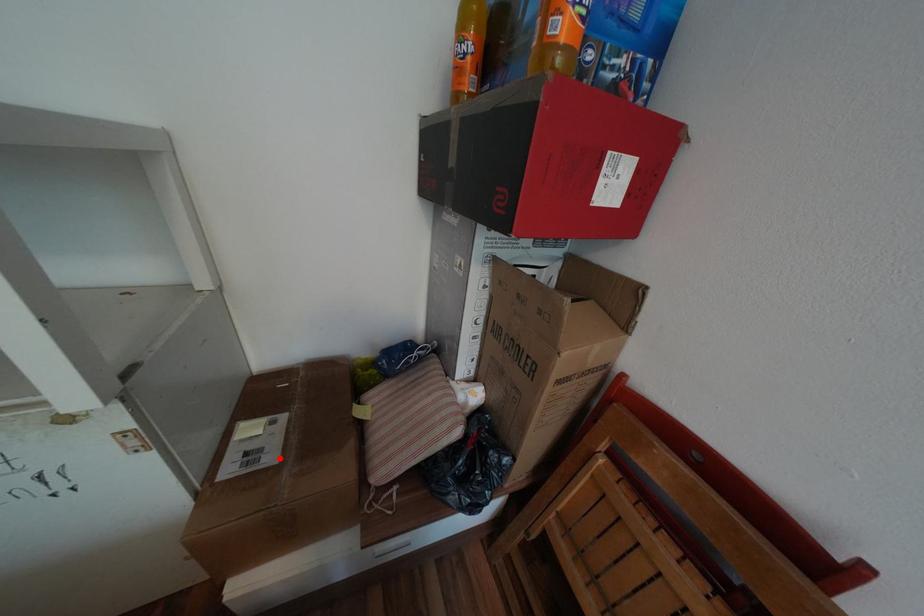
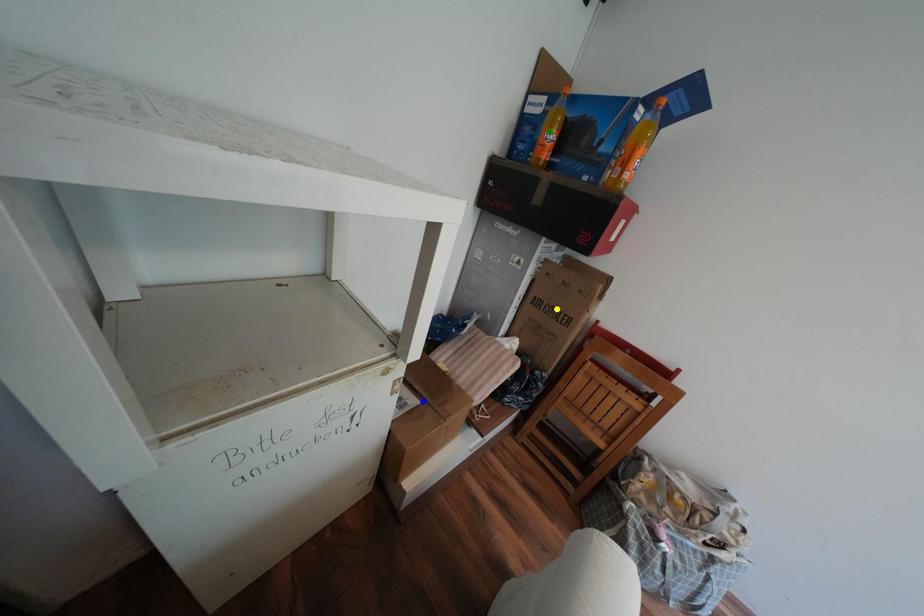
Question: I am providing you with two images of the same scene from different viewpoints. A red point is marked on the first image. You are given multiple points on the second image. Which point in image 2 is actually the same real-world point as the red point in image 1?

Choices:
 (A) yellow point
 (B) blue point
 (C) green point

Answer: (B)